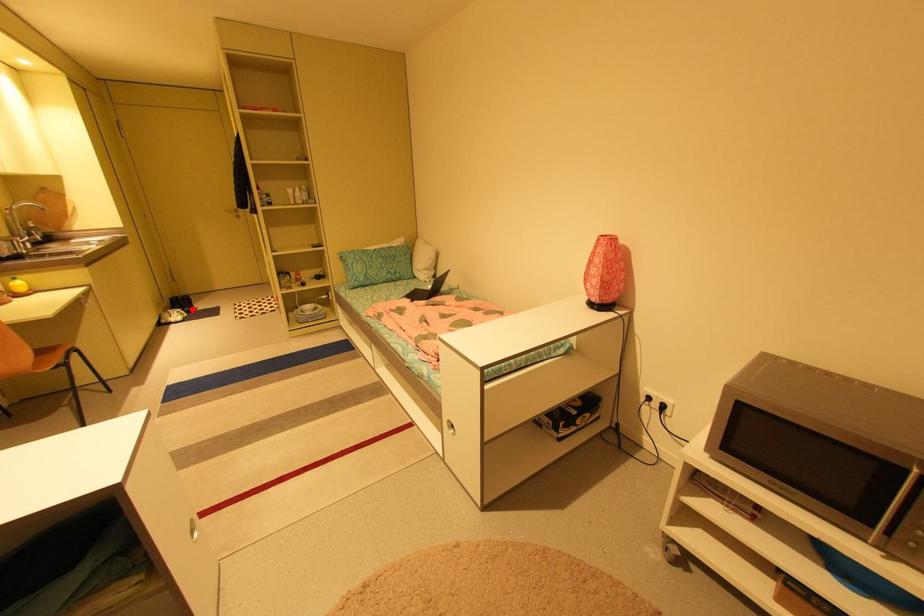
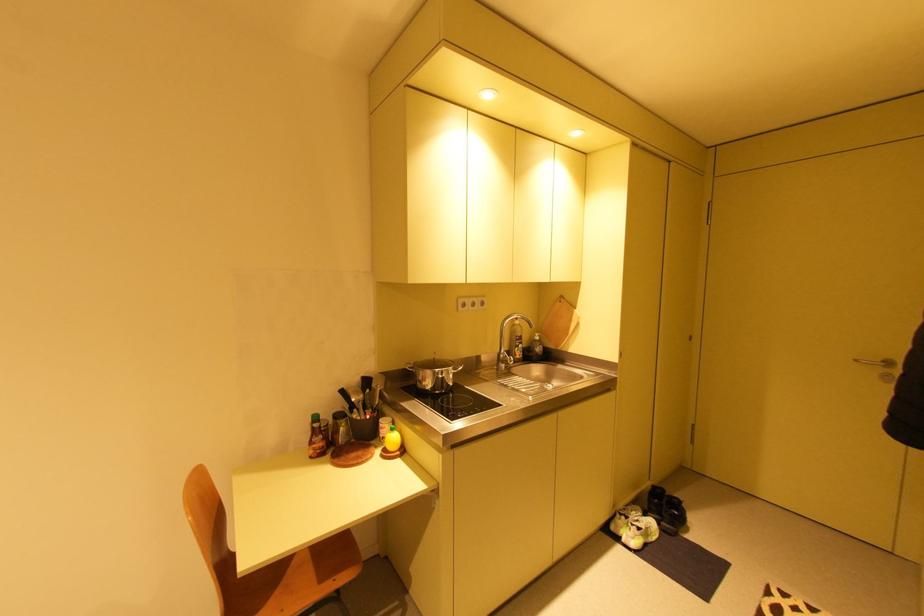
Question: I am providing you with two images of the same scene from different viewpoints. In image1, a red point is highlighted. Considering the same 3D point in image2, which of the following is correct?

Choices:
 (A) It is closer
 (B) It is farther

Answer: (B)